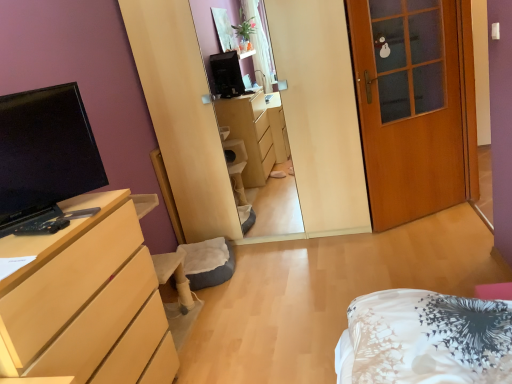
Question: Considering the relative positions of matte black tv at left and light wood/finish dresser at left in the image provided, is matte black tv at left to the left or to the right of light wood/finish dresser at left?

Choices:
 (A) left
 (B) right

Answer: (A)

Question: Considering their positions, is matte black tv at left located in front of or behind light wood/finish dresser at left?

Choices:
 (A) front
 (B) behind

Answer: (B)

Question: Considering the real-world distances, which object is closest to the matte black tv at left?

Choices:
 (A) wooden door at right
 (B) light wood/finish dresser at left

Answer: (B)

Question: Which is nearer to the matte black tv at left?

Choices:
 (A) wooden door at right
 (B) light wood/finish dresser at left

Answer: (B)